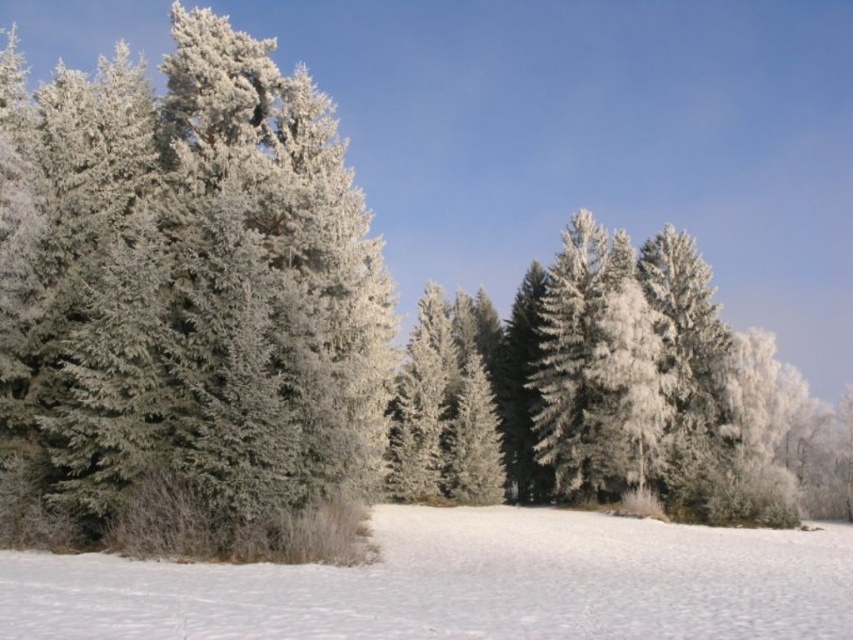
Question: Estimate the real-world distances between objects in this image. Which object is closer to the white fluffy snow at lower center?

Choices:
 (A) frosted pine tree at left
 (B) frosted pine trees at center

Answer: (A)

Question: Does frosted pine trees at center have a smaller size compared to white fluffy snow at lower center?

Choices:
 (A) yes
 (B) no

Answer: (B)

Question: Which object appears farthest from the camera in this image?

Choices:
 (A) white fluffy snow at lower center
 (B) frosted pine trees at center
 (C) frosted pine tree at left

Answer: (B)

Question: Does frosted pine tree at left appear over white fluffy snow at lower center?

Choices:
 (A) yes
 (B) no

Answer: (A)

Question: Is frosted pine tree at left positioned at the back of white fluffy snow at lower center?

Choices:
 (A) no
 (B) yes

Answer: (B)

Question: Among these objects, which one is farthest from the camera?

Choices:
 (A) frosted pine trees at center
 (B) white fluffy snow at lower center

Answer: (A)